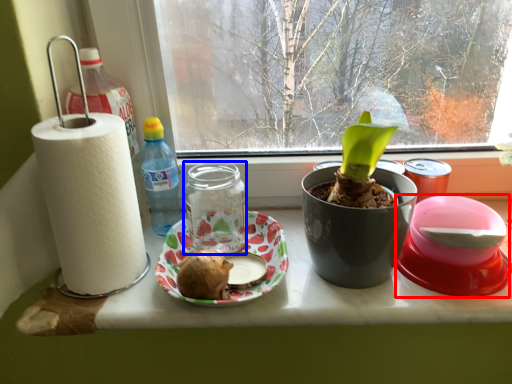
Question: Which point is closer to the camera, appliance (highlighted by a red box) or glass jar (highlighted by a blue box)?

Choices:
 (A) appliance
 (B) glass jar

Answer: (A)